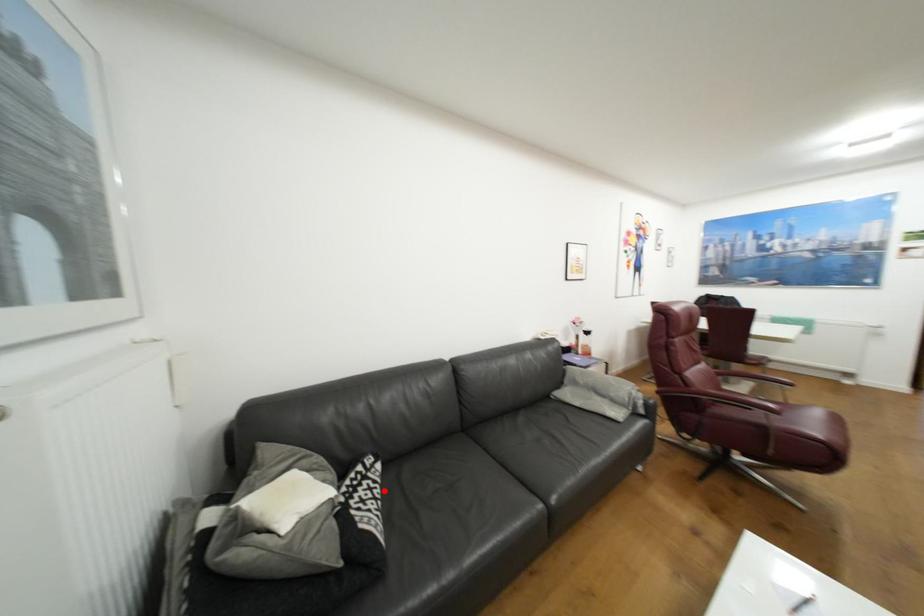
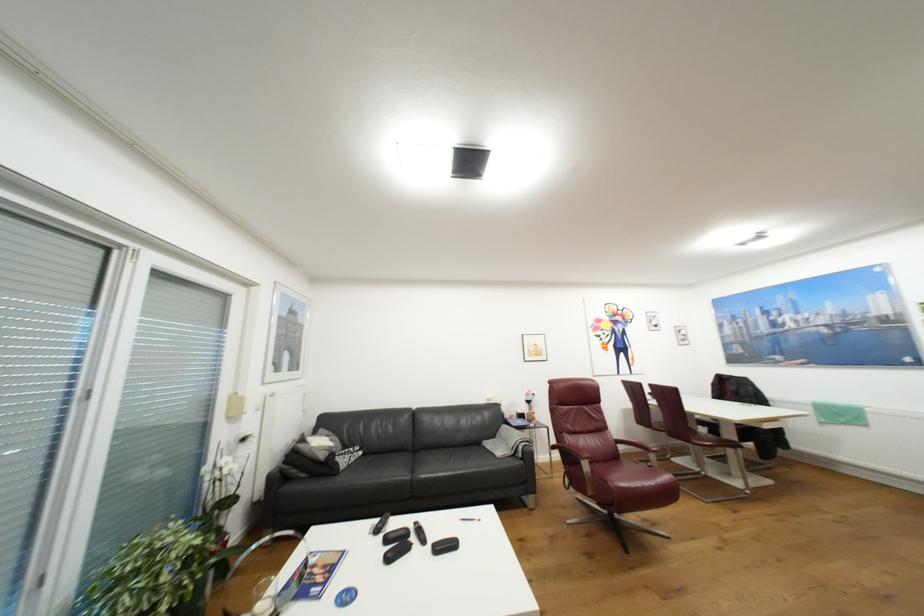
Locate, in the second image, the point that corresponds to the highlighted location in the first image.

(359, 459)